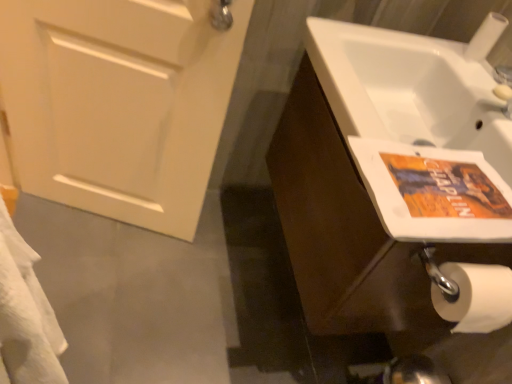
Find the location of a particular element. The height and width of the screenshot is (384, 512). free region under orange paper flyer at right (from a real-world perspective) is located at coordinates (442, 184).